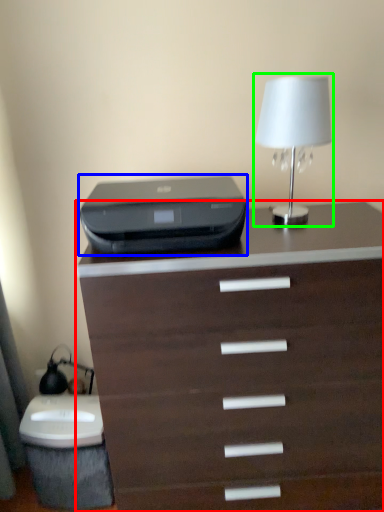
Question: Considering the real-world distances, which object is closest to chest of drawers (highlighted by a red box)? printer (highlighted by a blue box) or table lamp (highlighted by a green box).

Choices:
 (A) printer
 (B) table lamp

Answer: (A)